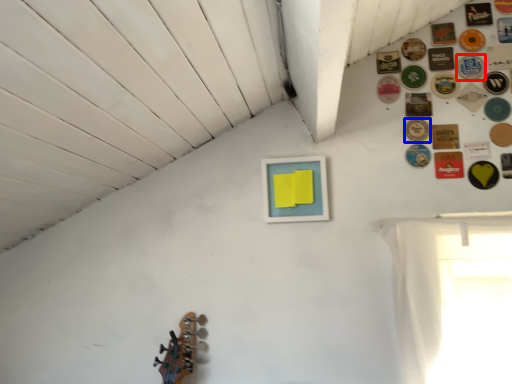
Question: Among these objects, which one is nearest to the camera, button (highlighted by a red box) or button (highlighted by a blue box)?

Choices:
 (A) button
 (B) button

Answer: (B)